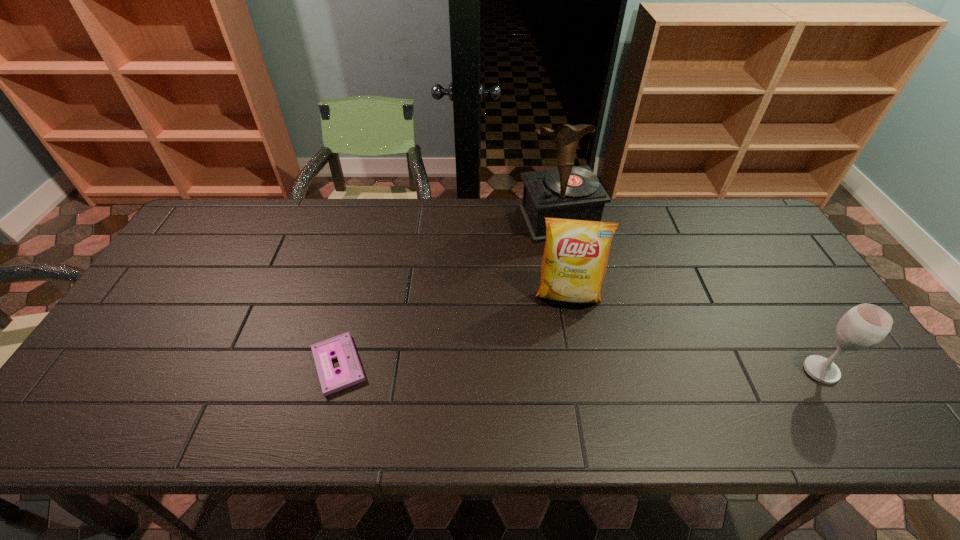
You are a GUI agent. You are given a task and a screenshot of the screen. Output one action in this format:
    pyautogui.click(x=<x>, y=<y>)
    Task: Click on the vacant spot on the desktop that is between the leftmost object and the wineglass and is positioned on the front-facing side of the crisp (potato chip)
    
    Given the screenshot: What is the action you would take?
    pyautogui.click(x=569, y=367)

This screenshot has height=540, width=960. Find the location of `free spot on the desktop that is between the leftmost object and the rightmost object and is positioned at the horn opening of the phonograph_record`. free spot on the desktop that is between the leftmost object and the rightmost object and is positioned at the horn opening of the phonograph_record is located at coordinates (632, 368).